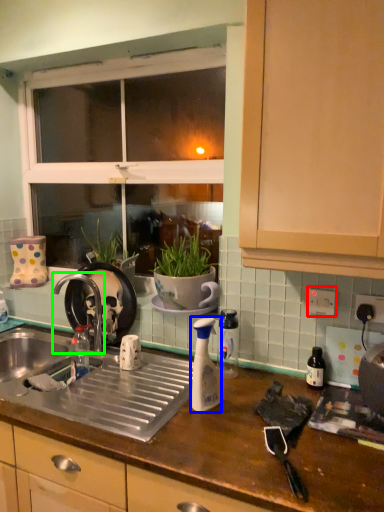
Question: Which is farther away from electric outlet (highlighted by a red box)? bottle (highlighted by a blue box) or tap (highlighted by a green box)?

Choices:
 (A) bottle
 (B) tap

Answer: (B)